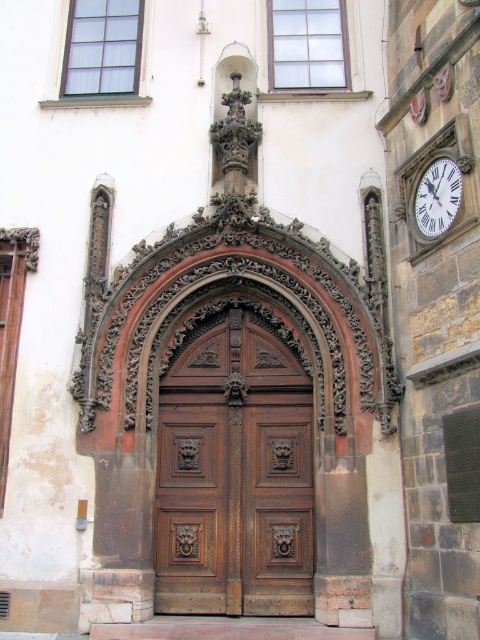
Question: In this image, where is polished wood door at center located relative to white glossy clock at upper right?

Choices:
 (A) left
 (B) right

Answer: (A)

Question: Can you confirm if polished wood door at center is thinner than white glossy clock at upper right?

Choices:
 (A) no
 (B) yes

Answer: (A)

Question: Can you confirm if polished wood door at center is bigger than white glossy clock at upper right?

Choices:
 (A) yes
 (B) no

Answer: (A)

Question: Which point is farther from the camera taking this photo?

Choices:
 (A) (211, 604)
 (B) (458, 182)

Answer: (A)